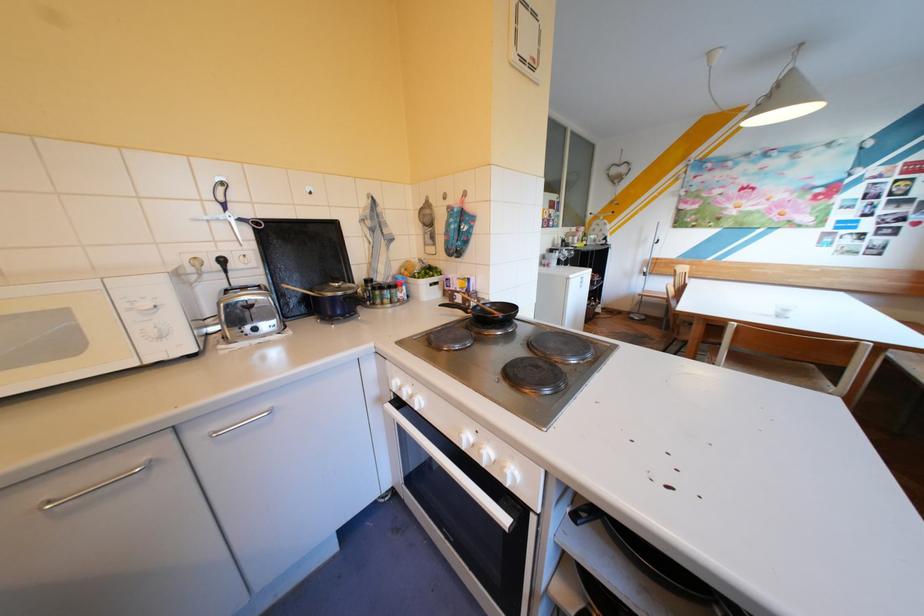
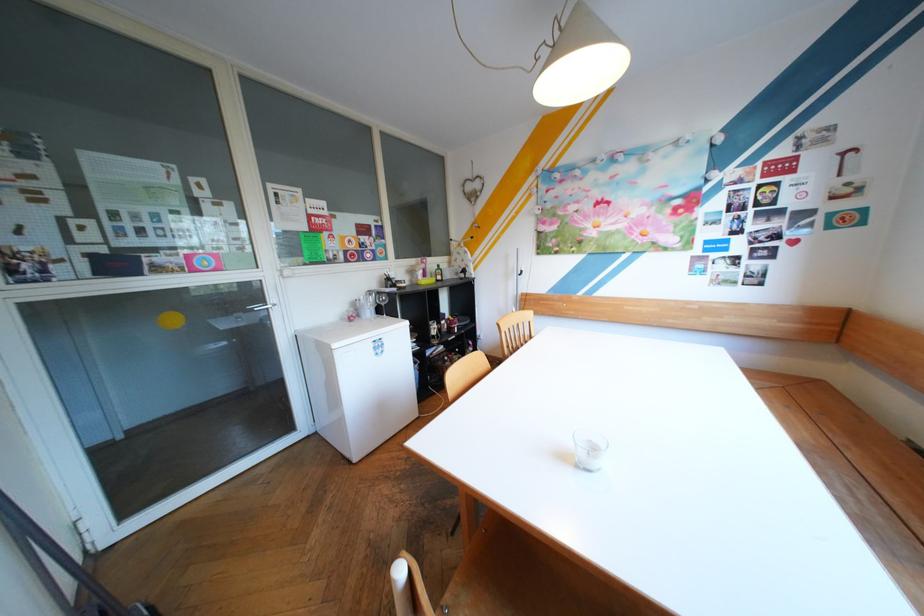
The point at [579,229] is marked in the first image. Where is the corresponding point in the second image?

(426, 261)